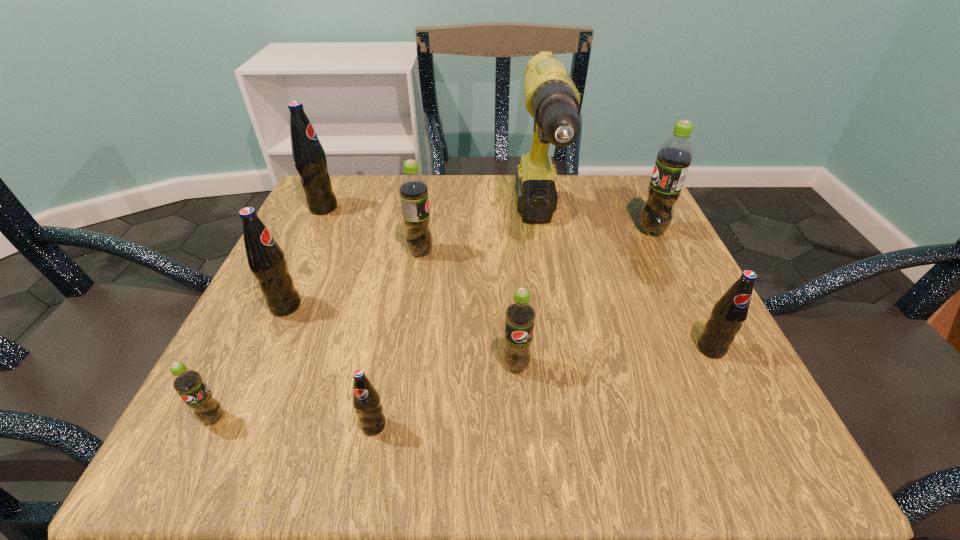
The width and height of the screenshot is (960, 540). In order to click on the third biggest black pop in this screenshot , I will do tap(727, 316).

Locate an element on the screen. Image resolution: width=960 pixels, height=540 pixels. the third soda from right to left is located at coordinates (520, 315).

Identify the location of the third farthest green soda. Image resolution: width=960 pixels, height=540 pixels. (520, 315).

Find the location of a particular element. the third black pop from left to right is located at coordinates (366, 400).

The width and height of the screenshot is (960, 540). I want to click on the nearest black pop, so click(366, 400).

The height and width of the screenshot is (540, 960). I want to click on the smallest green soda, so click(x=188, y=383).

At what (x,y) coordinates should I click in order to perform the action: click on the leftmost green soda. Please return your answer as a coordinate pair (x, y). The width and height of the screenshot is (960, 540). Looking at the image, I should click on (188, 383).

Where is `free space located 0.060m on the handle side of the drill`? Image resolution: width=960 pixels, height=540 pixels. free space located 0.060m on the handle side of the drill is located at coordinates (551, 308).

The width and height of the screenshot is (960, 540). I want to click on blank space located on the front label of the farthest black pop, so click(437, 208).

Find the location of a particular element. blank space located 0.280m on the front label of the rightmost green soda is located at coordinates (502, 231).